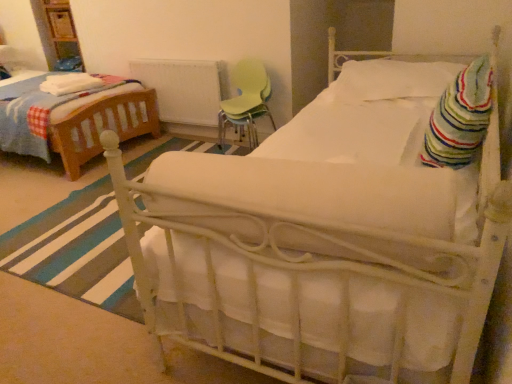
Question: Looking at their shapes, would you say white soft blanket at left, marked as the 1th blanket in a left-to-right arrangement, is wider or thinner than green plastic chair at center?

Choices:
 (A) thin
 (B) wide

Answer: (A)

Question: From the image's perspective, is white soft blanket at left, which is the 1th blanket in back-to-front order, above or below green plastic chair at center?

Choices:
 (A) below
 (B) above

Answer: (B)

Question: Considering the real-world distances, which object is closest to the white soft pillow at upper right?

Choices:
 (A) white soft blanket at left, marked as the 1th blanket in a left-to-right arrangement
 (B) white painted metal radiator at center
 (C) striped cotton blanket at right, the 2th blanket in the back-to-front sequence
 (D) white fabric bed at center
 (E) green plastic chair at center

Answer: (C)

Question: Which object is positioned farthest from the green plastic chair at center?

Choices:
 (A) white painted metal radiator at center
 (B) white fabric bed at center
 (C) white soft blanket at left, marked as the 1th blanket in a left-to-right arrangement
 (D) striped cotton blanket at right, the 2th blanket from the left
 (E) white soft pillow at upper right

Answer: (D)